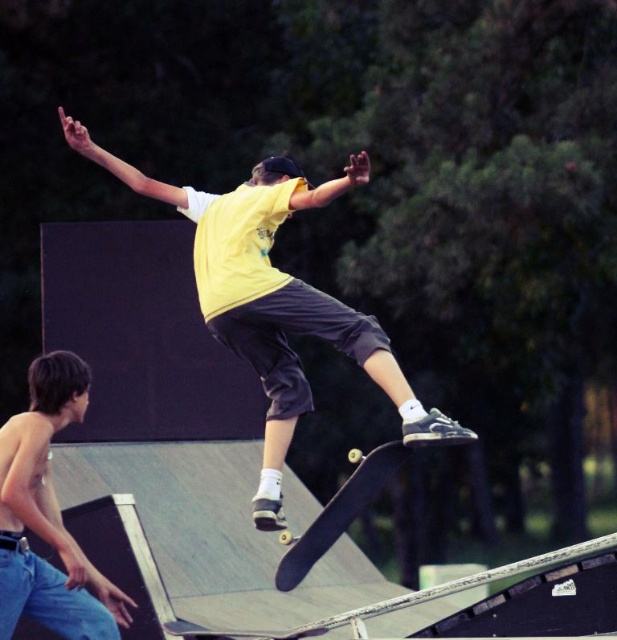
Who is lower down, yellow matte shirt at center or shiny blue jeans at lower left?

shiny blue jeans at lower left is lower down.

Who is positioned more to the right, yellow matte shirt at center or shiny blue jeans at lower left?

yellow matte shirt at center is more to the right.

I want to click on yellow matte shirt at center, so click(x=275, y=301).

Does yellow matte shirt at center have a larger size compared to black smooth skateboard at center?

Incorrect, yellow matte shirt at center is not larger than black smooth skateboard at center.

Is point (308, 324) closer to viewer compared to point (371, 477)?

That is False.

Between point (404, 390) and point (304, 552), which one is positioned behind?

The point (304, 552) is behind.

The image size is (617, 640). In order to click on yellow matte shirt at center in this screenshot , I will do `click(275, 301)`.

Is point (12, 467) closer to camera compared to point (376, 480)?

Yes, it is in front of point (376, 480).

Does shiny blue jeans at lower left appear under black smooth skateboard at center?

Actually, shiny blue jeans at lower left is above black smooth skateboard at center.

The image size is (617, 640). Identify the location of shiny blue jeans at lower left. (48, 515).